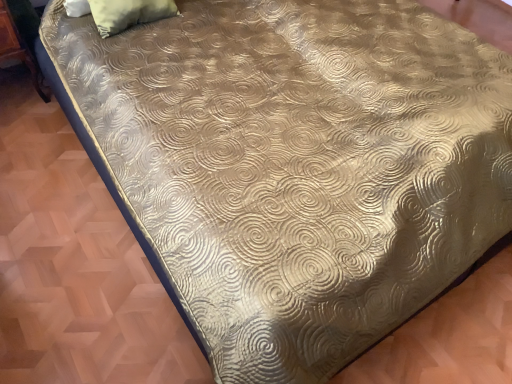
Locate an element on the screen. free spot in front of wooden dresser at left is located at coordinates coord(20,132).